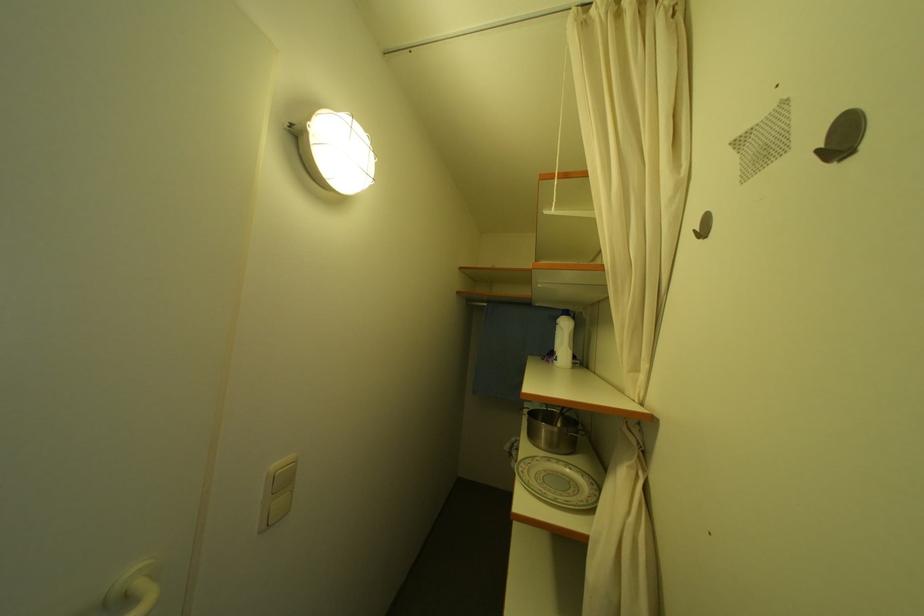
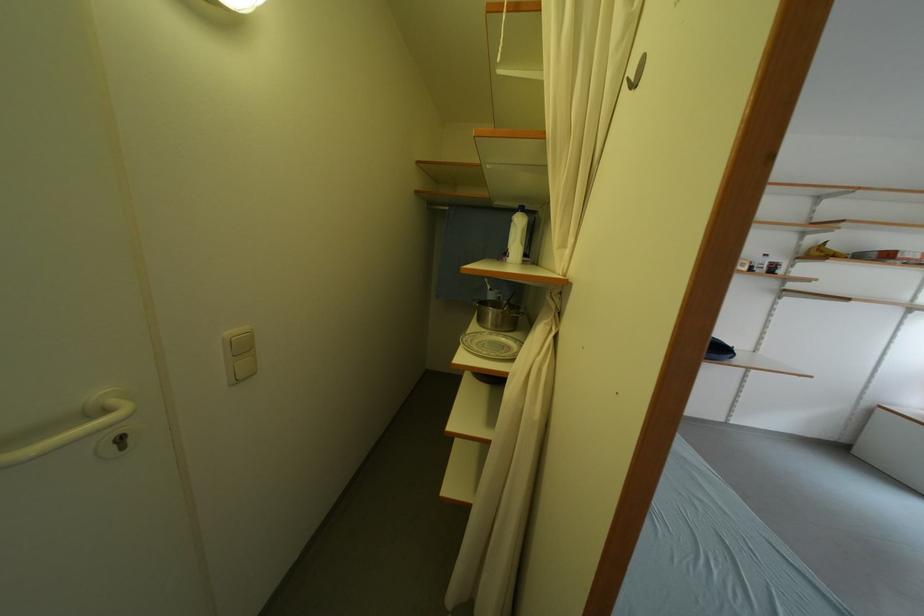
The point at (564, 328) is marked in the first image. Where is the corresponding point in the second image?

(518, 225)